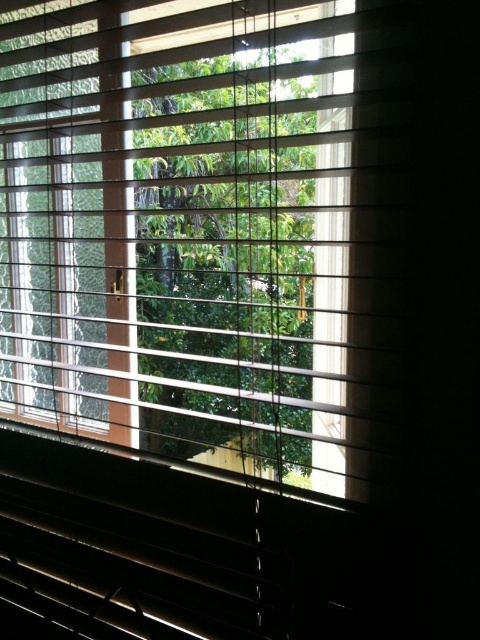
You are standing in a room with a window. You see the wooden blinds at center and the green leafy tree at center. Which object is larger in the image?

The wooden blinds at center is bigger than the green leafy tree at center.

You are standing in a room and looking through the window with blinds. There are two points marked on the window frame. The first point is at coordinates point (245, 67) and the second is at point (212, 403). Which point is closer to you?

Point (245, 67) is closer to the viewer than point (212, 403).

You are standing inside a room and looking through the window. You see the wooden blinds at center and the green leafy tree at center. Which object is closer to the ceiling?

The wooden blinds at center are above the green leafy tree at center, so the wooden blinds at center are closer to the ceiling.